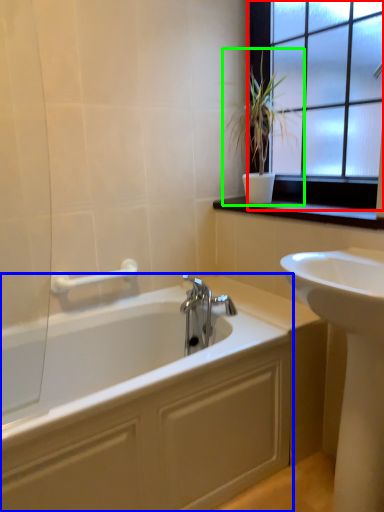
Question: Which object is the closest to the window (highlighted by a red box)? Choose among these: bathtub (highlighted by a blue box) or houseplant (highlighted by a green box).

Choices:
 (A) bathtub
 (B) houseplant

Answer: (B)